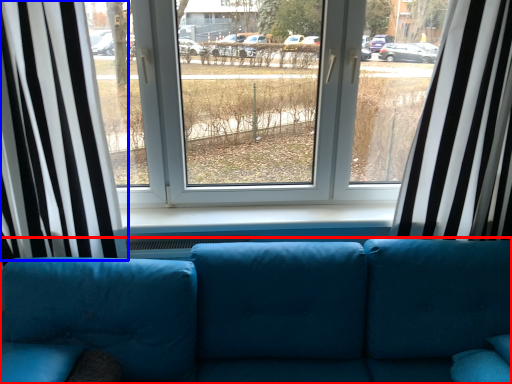
Question: Which point is closer to the camera, studio couch (highlighted by a red box) or curtain (highlighted by a blue box)?

Choices:
 (A) studio couch
 (B) curtain

Answer: (A)